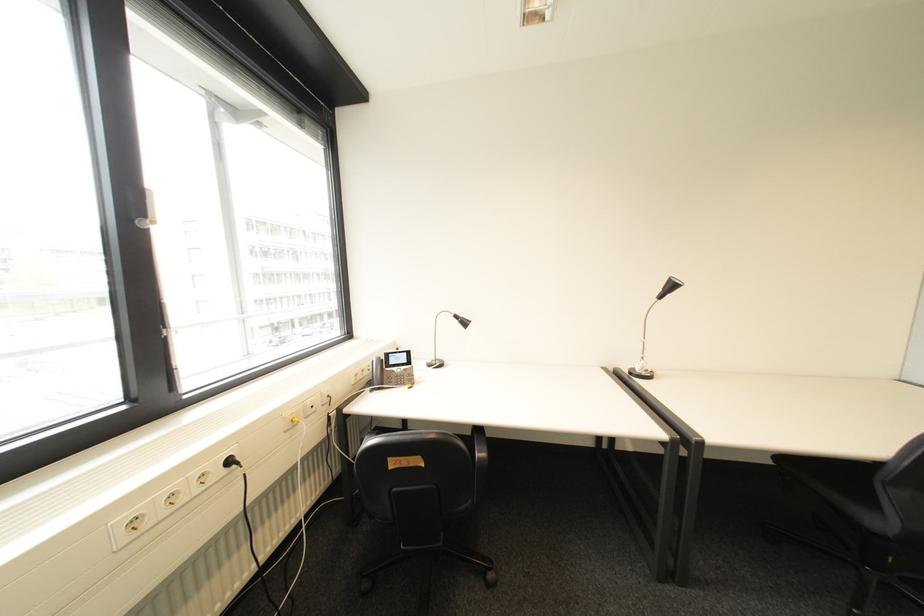
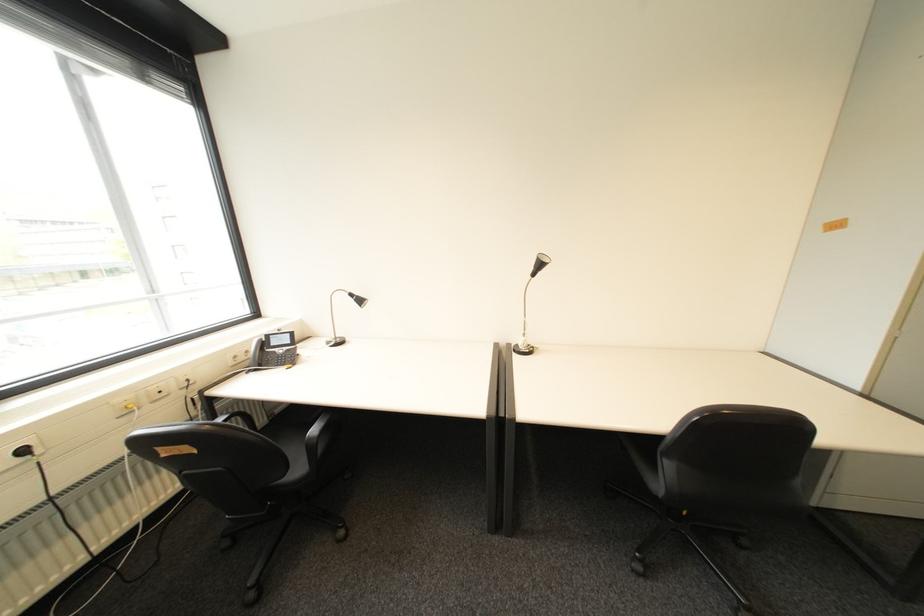
Where in the second image is the point corresponding to the point at 239,463 from the first image?

(34, 452)